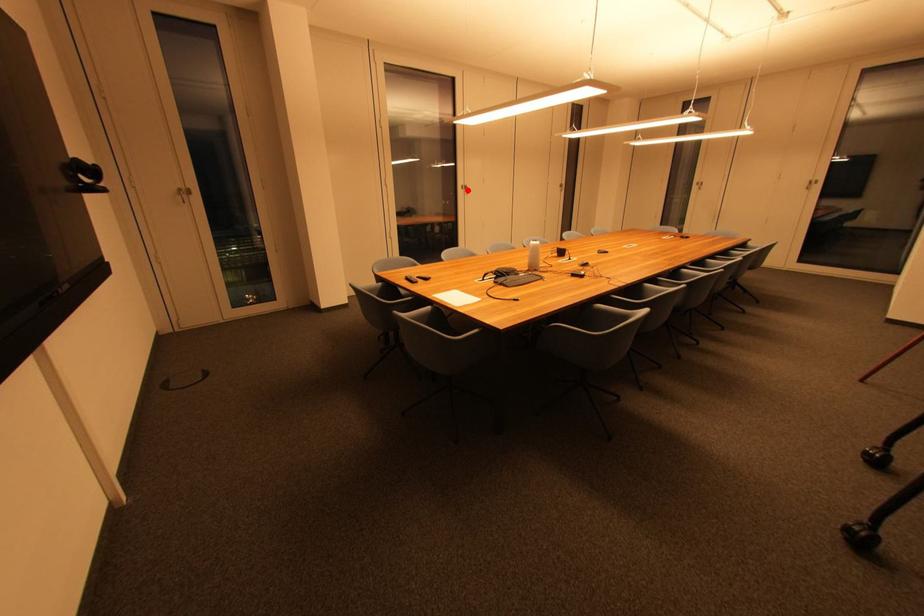
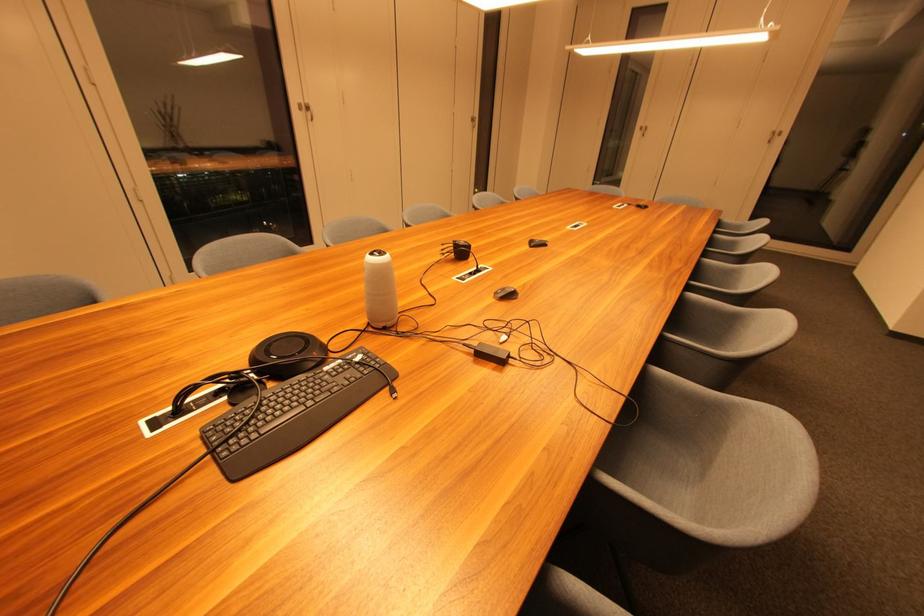
Question: I am providing you with two images of the same scene from different viewpoints. A red point is shown in image1. For the corresponding object point in image2, is it positioned nearer or farther from the camera?

Choices:
 (A) Nearer
 (B) Farther

Answer: (B)